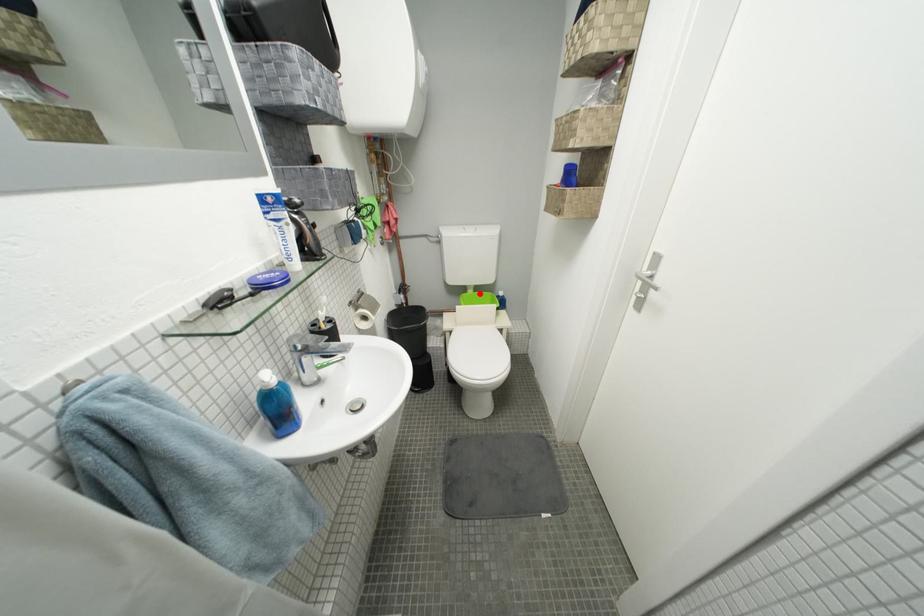
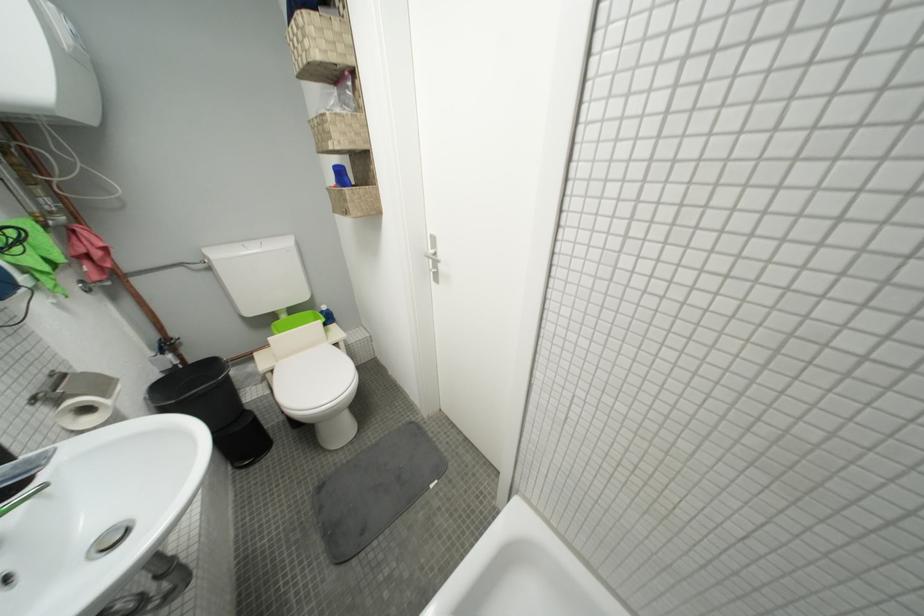
Where in the second image is the point corresponding to the highlighted location from the first image?

(293, 318)